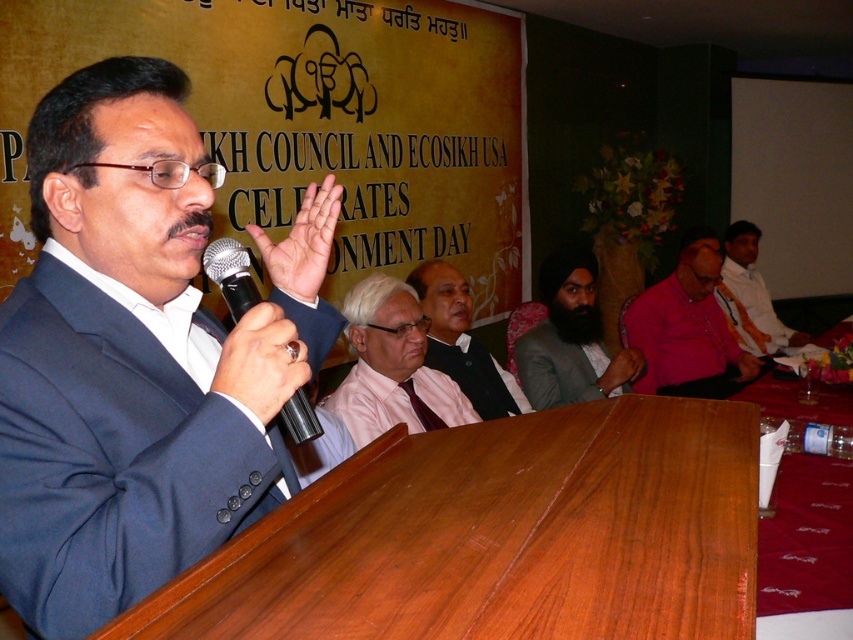
Question: Which object is closer to the camera taking this photo?

Choices:
 (A) black metallic microphone at center
 (B) black satin business suit at center
 (C) pink fabric at center

Answer: (A)

Question: Which of these objects is positioned farthest from the matte black wristband at lower center?

Choices:
 (A) blue suit at center
 (B) black satin business suit at center

Answer: (A)

Question: Considering the real-world distances, which object is farthest from the black metallic microphone at center?

Choices:
 (A) pink fabric shirt at center
 (B) matte skin palm at center

Answer: (A)

Question: Does black satin business suit at center have a smaller size compared to black metallic microphone at center?

Choices:
 (A) yes
 (B) no

Answer: (B)

Question: Is pink cotton shirt at center closer to the viewer compared to black metallic microphone at center?

Choices:
 (A) no
 (B) yes

Answer: (A)

Question: In this image, where is pink cotton shirt at center located relative to matte black wristband at lower center?

Choices:
 (A) left
 (B) right

Answer: (B)